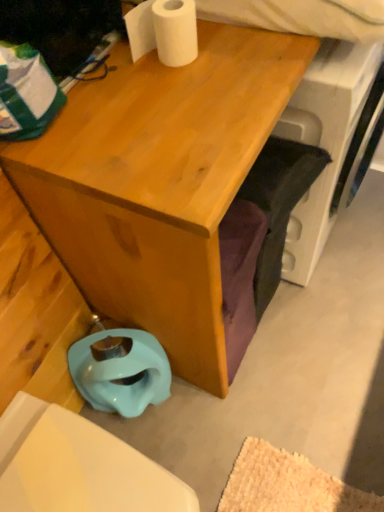
Question: From the image's perspective, is light blue rubber toilet bowl at lower left on top of white matte toilet paper at upper center?

Choices:
 (A) no
 (B) yes

Answer: (A)

Question: Is light blue rubber toilet bowl at lower left wider than white matte toilet paper at upper center?

Choices:
 (A) no
 (B) yes

Answer: (B)

Question: Can you confirm if light blue rubber toilet bowl at lower left is smaller than white matte toilet paper at upper center?

Choices:
 (A) yes
 (B) no

Answer: (B)

Question: From a real-world perspective, is light blue rubber toilet bowl at lower left positioned over white matte toilet paper at upper center based on gravity?

Choices:
 (A) no
 (B) yes

Answer: (A)

Question: Is white matte toilet paper at upper center a part of light blue rubber toilet bowl at lower left?

Choices:
 (A) no
 (B) yes

Answer: (A)

Question: Is point (150, 23) positioned closer to the camera than point (74, 353)?

Choices:
 (A) closer
 (B) farther

Answer: (A)

Question: Based on their sizes in the image, would you say white matte toilet paper at upper center is bigger or smaller than light blue rubber toilet bowl at lower left?

Choices:
 (A) small
 (B) big

Answer: (A)

Question: Considering the relative positions of white matte toilet paper at upper center and light blue rubber toilet bowl at lower left in the image provided, is white matte toilet paper at upper center to the left or to the right of light blue rubber toilet bowl at lower left?

Choices:
 (A) left
 (B) right

Answer: (B)

Question: In terms of height, does white matte toilet paper at upper center look taller or shorter compared to light blue rubber toilet bowl at lower left?

Choices:
 (A) tall
 (B) short

Answer: (B)

Question: Visually, is light blue rubber toilet bowl at lower left positioned to the left or to the right of white matte toilet paper at upper center?

Choices:
 (A) right
 (B) left

Answer: (B)

Question: Is light blue rubber toilet bowl at lower left wider or thinner than white matte toilet paper at upper center?

Choices:
 (A) thin
 (B) wide

Answer: (B)

Question: Considering the positions of light blue rubber toilet bowl at lower left and white matte toilet paper at upper center in the image, is light blue rubber toilet bowl at lower left bigger or smaller than white matte toilet paper at upper center?

Choices:
 (A) small
 (B) big

Answer: (B)

Question: From a real-world perspective, is light blue rubber toilet bowl at lower left positioned above or below white matte toilet paper at upper center?

Choices:
 (A) below
 (B) above

Answer: (A)

Question: Looking at their shapes, would you say light blue rubber toilet bowl at lower left is wider or thinner than matte wood desk at center?

Choices:
 (A) thin
 (B) wide

Answer: (A)

Question: Relative to matte wood desk at center, is light blue rubber toilet bowl at lower left in front or behind?

Choices:
 (A) front
 (B) behind

Answer: (B)